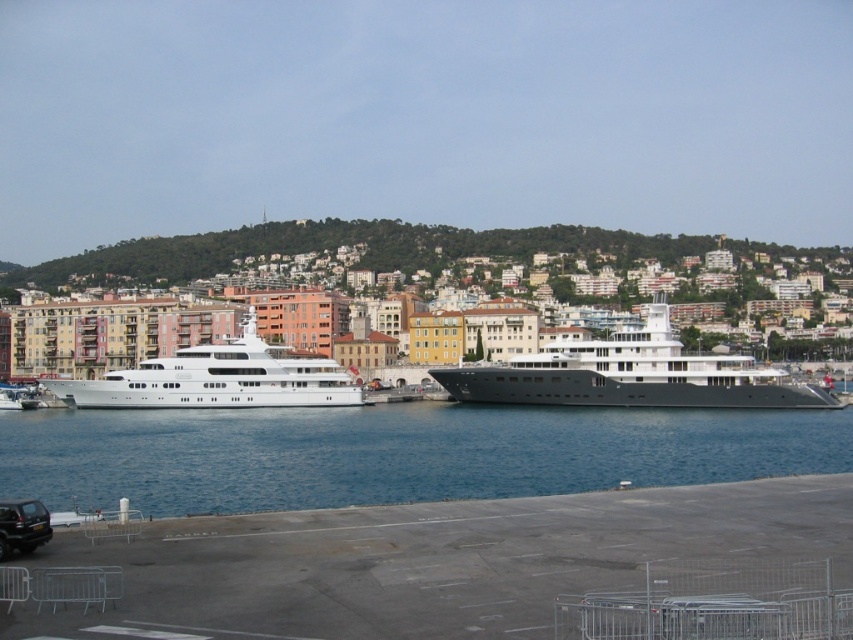
Question: Does blue water at center appear on the right side of white glossy yacht at left?

Choices:
 (A) no
 (B) yes

Answer: (B)

Question: Which object is farther from the camera taking this photo?

Choices:
 (A) blue water at center
 (B) black glossy yacht at center

Answer: (B)

Question: Considering the real-world distances, which object is farthest from the black glossy yacht at center?

Choices:
 (A) white glossy yacht at left
 (B) black matte car at lower left

Answer: (B)

Question: Can you confirm if blue water at center is wider than black glossy yacht at center?

Choices:
 (A) yes
 (B) no

Answer: (A)

Question: Does blue water at center appear on the left side of black matte car at lower left?

Choices:
 (A) yes
 (B) no

Answer: (B)

Question: Which point is farther from the camera taking this photo?

Choices:
 (A) (254, 508)
 (B) (144, 400)
 (C) (25, 515)
 (D) (654, 355)

Answer: (D)